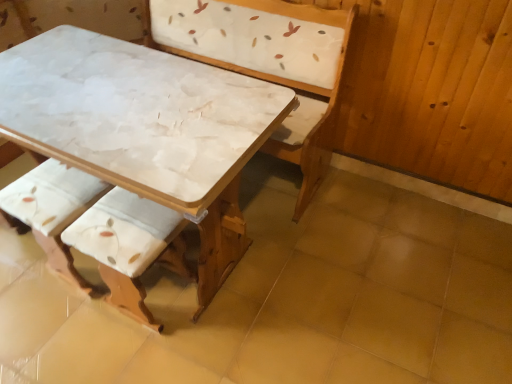
Locate an element on the screen. The image size is (512, 384). free space to the left of white fabric cushion at lower left, the 2th armchair positioned from the left is located at coordinates coord(60,325).